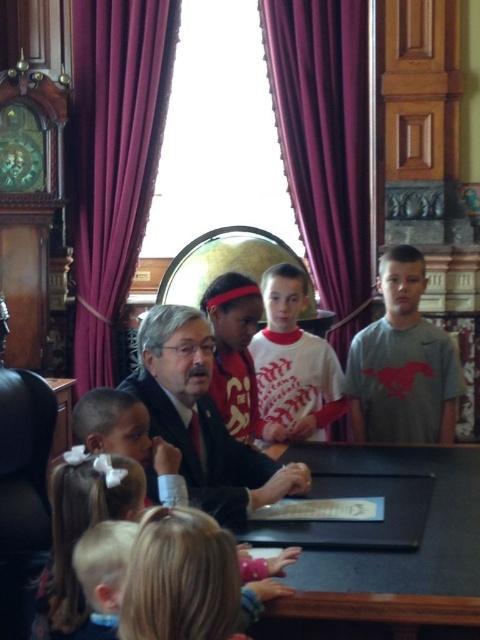
Question: Considering the real-world distances, which object is farthest from the blonde hair with bow at lower left?

Choices:
 (A) matte red headband at center
 (B) purple velvet curtain at upper center
 (C) gray matte shirt at right

Answer: (B)

Question: Which object appears closest to the camera in this image?

Choices:
 (A) black suit at center
 (B) purple velvet curtain at upper center
 (C) blonde hair with bow at lower left

Answer: (C)

Question: Is black suit at center above blonde hair with bow at lower left?

Choices:
 (A) no
 (B) yes

Answer: (B)

Question: Which object appears closest to the camera in this image?

Choices:
 (A) matte red headband at center
 (B) white cotton shirt at center
 (C) black suit at center

Answer: (C)

Question: Is purple velvet curtain at left below white cotton shirt at center?

Choices:
 (A) no
 (B) yes

Answer: (A)

Question: Considering the relative positions of black glossy table at center and white cotton shirt at center in the image provided, where is black glossy table at center located with respect to white cotton shirt at center?

Choices:
 (A) above
 (B) below

Answer: (B)